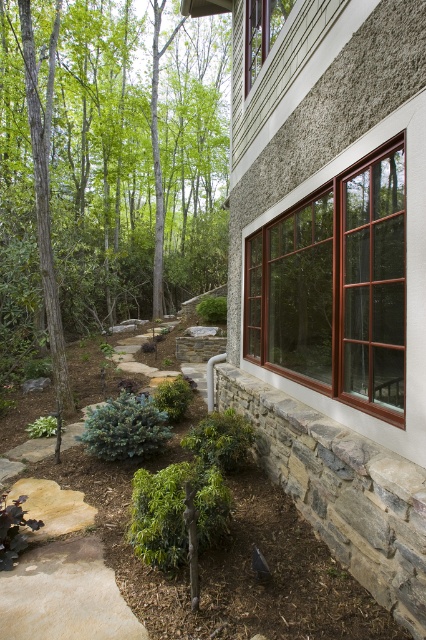
What do you see at coordinates (101, 164) in the screenshot? Image resolution: width=426 pixels, height=640 pixels. I see `green leafy tree at upper left` at bounding box center [101, 164].

Is green leafy tree at upper left wider than brown glass window at center right?

Indeed, green leafy tree at upper left has a greater width compared to brown glass window at center right.

Is point (2, 100) positioned in front of point (293, 205)?

No, it is not.

What are the coordinates of `green leafy tree at upper left` in the screenshot? It's located at (101, 164).